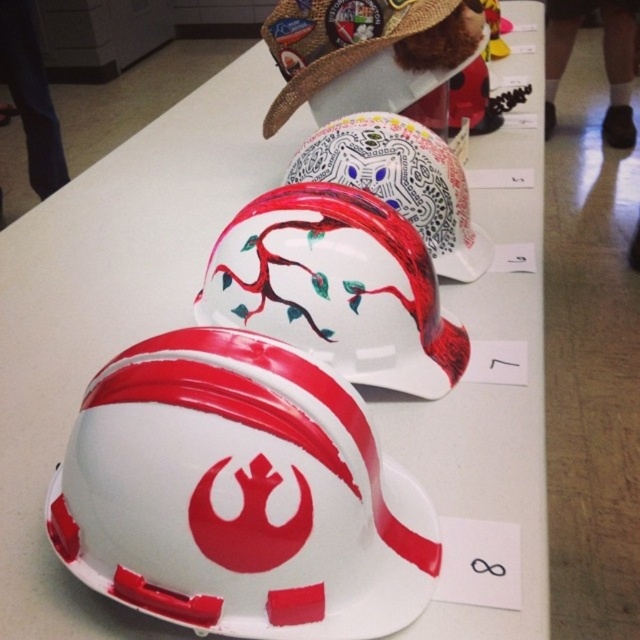
You are an artist standing at the corner of the table. You want to place a new golden star sticker on the white glossy helmet at lower left. According to the coordinates provided, where should you place it?

The white glossy helmet at lower left is located at point (240, 493), so place the golden star sticker there.

You are organizing a display and need to ensure that all helmets fit within a designated area. The white glossy helmet at lower left and the glossy white helmet at center are both on the table. Which helmet requires more space to display?

The glossy white helmet at center requires more space to display because it occupies more space than the white glossy helmet at lower left.

You are an artist trying to stack the white glossy helmet at lower left and the brown straw cowboy hat at upper center on top of each other. Which one should you place at the bottom to ensure stability?

The white glossy helmet at lower left is taller than the brown straw cowboy hat at upper center, so placing the taller helmet at the bottom would provide a stable base for the shorter hat.